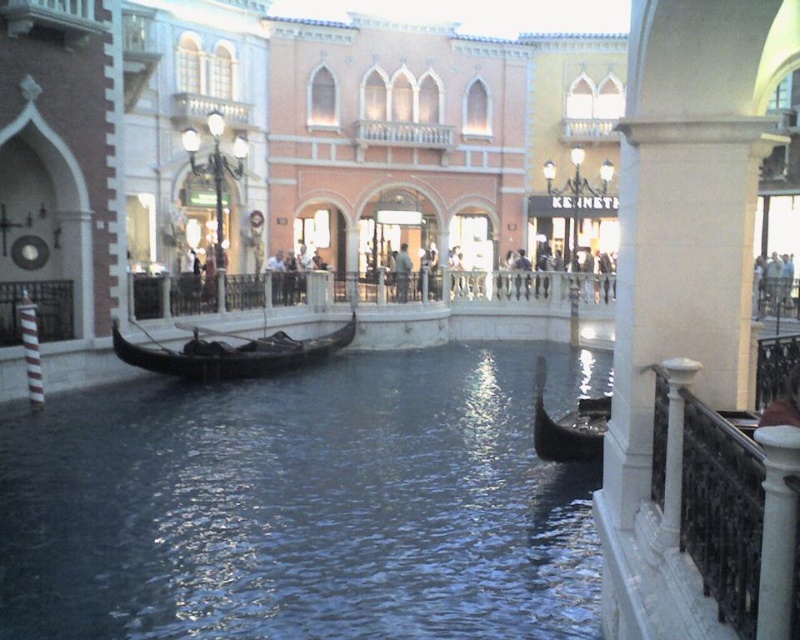
You are planning to take a ride on one of the gondolas in the Venetian canal scene. The black polished wood gondola at center and the wooden gondola at lower right are both available. Which gondola would you choose if you want a larger vessel for more passengers?

The black polished wood gondola at center is bigger than the wooden gondola at lower right, so it can accommodate more passengers.

You are a guest staying at this Venetian canal resort and want to take a photo of the black polished wood gondola at center and the dark gray fabric jacket at center. Which object should you focus on first if you want to capture both in a single frame without moving the camera?

The black polished wood gondola at center is shorter than the dark gray fabric jacket at center, so you should focus on the dark gray fabric jacket at center first to ensure both are in frame.

You are standing on a bridge overlooking the canal. You see the black polished wood gondola at center and the dark gray fabric jacket at center. Which object is positioned higher from your viewpoint?

The dark gray fabric jacket at center is positioned higher than the black polished wood gondola at center because the gondola is located below the jacket.